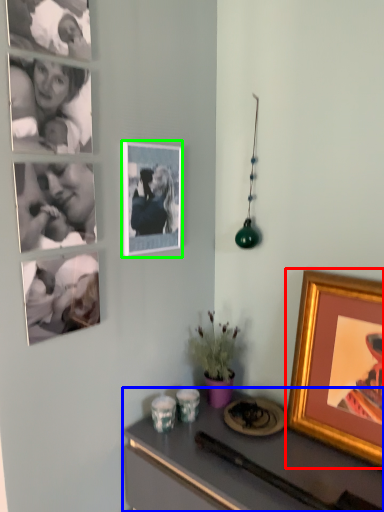
Question: Considering the real-world distances, which object is closest to picture frame (highlighted by a red box)? desk (highlighted by a blue box) or picture frame (highlighted by a green box).

Choices:
 (A) desk
 (B) picture frame

Answer: (A)